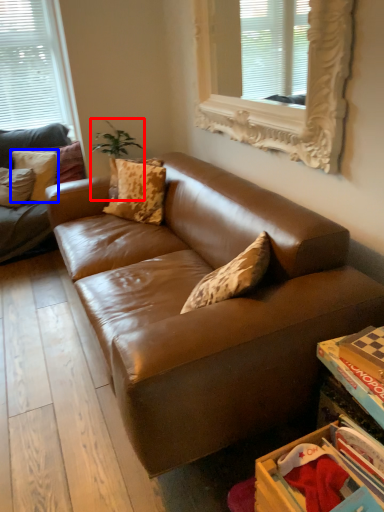
Question: Among these objects, which one is farthest to the camera, plant (highlighted by a red box) or pillow (highlighted by a blue box)?

Choices:
 (A) plant
 (B) pillow

Answer: (B)